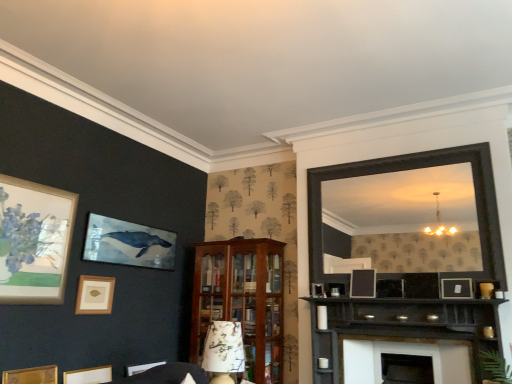
Question: Is matte black picture frame at center, which is counted as the 4th picture frame, starting from the left, not inside matte gold picture frame at lower left, the 3th picture frame from the right?

Choices:
 (A) yes
 (B) no

Answer: (A)

Question: Is matte black picture frame at center, which appears as the second picture frame when viewed from the right, at the right side of matte gold picture frame at lower left, the 3th picture frame from the right?

Choices:
 (A) no
 (B) yes

Answer: (B)

Question: From a real-world perspective, does matte black picture frame at center, which is counted as the 4th picture frame, starting from the left, sit lower than matte gold picture frame at lower left, the 3th picture frame from the right?

Choices:
 (A) yes
 (B) no

Answer: (B)

Question: Is matte black picture frame at center, which appears as the second picture frame when viewed from the right, not close to matte gold picture frame at lower left, the 3th picture frame from the right?

Choices:
 (A) no
 (B) yes

Answer: (B)

Question: Is matte black picture frame at center, which appears as the second picture frame when viewed from the right, looking in the opposite direction of matte gold picture frame at lower left, the 3th picture frame from the right?

Choices:
 (A) yes
 (B) no

Answer: (B)

Question: Considering the positions of point (272, 375) and point (454, 291), is point (272, 375) closer or farther from the camera than point (454, 291)?

Choices:
 (A) closer
 (B) farther

Answer: (B)

Question: From their relative heights in the image, would you say wooden cabinet at center is taller or shorter than matte black picture frame at upper right, acting as the fifth picture frame starting from the left?

Choices:
 (A) tall
 (B) short

Answer: (A)

Question: Considering the relative positions of wooden cabinet at center and matte black picture frame at upper right, acting as the fifth picture frame starting from the left, in the image provided, is wooden cabinet at center to the left or to the right of matte black picture frame at upper right, acting as the fifth picture frame starting from the left,?

Choices:
 (A) left
 (B) right

Answer: (A)

Question: Is wooden cabinet at center inside the boundaries of matte black picture frame at upper right, acting as the first picture frame starting from the right, or outside?

Choices:
 (A) inside
 (B) outside

Answer: (B)

Question: Considering the positions of matte gold picture frame at lower left, the 2th picture frame in the left-to-right sequence, and black wooden mirror at upper right in the image, is matte gold picture frame at lower left, the 2th picture frame in the left-to-right sequence, taller or shorter than black wooden mirror at upper right?

Choices:
 (A) tall
 (B) short

Answer: (B)

Question: Would you say matte gold picture frame at lower left, acting as the 4th picture frame starting from the right, is inside or outside black wooden mirror at upper right?

Choices:
 (A) outside
 (B) inside

Answer: (A)

Question: From a real-world perspective, is matte gold picture frame at lower left, acting as the 4th picture frame starting from the right, physically located above or below black wooden mirror at upper right?

Choices:
 (A) above
 (B) below

Answer: (B)

Question: From the image's perspective, is matte gold picture frame at lower left, acting as the 4th picture frame starting from the right, positioned above or below black wooden mirror at upper right?

Choices:
 (A) below
 (B) above

Answer: (A)

Question: Is point (227, 372) positioned closer to the camera than point (79, 304)?

Choices:
 (A) farther
 (B) closer

Answer: (B)

Question: From their relative heights in the image, would you say floral-patterned fabric lampshade at center is taller or shorter than matte gold picture frame at lower left, the 2th picture frame in the left-to-right sequence?

Choices:
 (A) short
 (B) tall

Answer: (B)